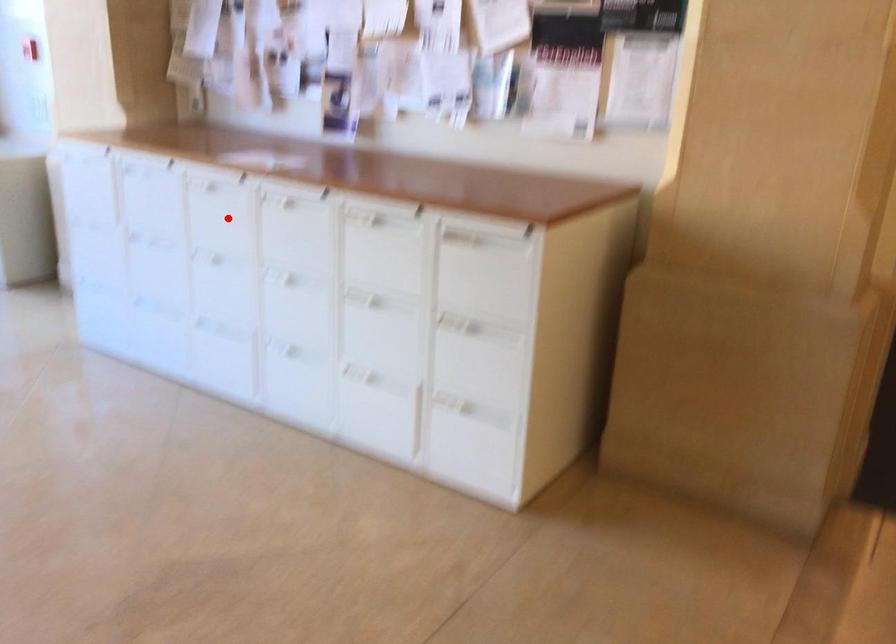
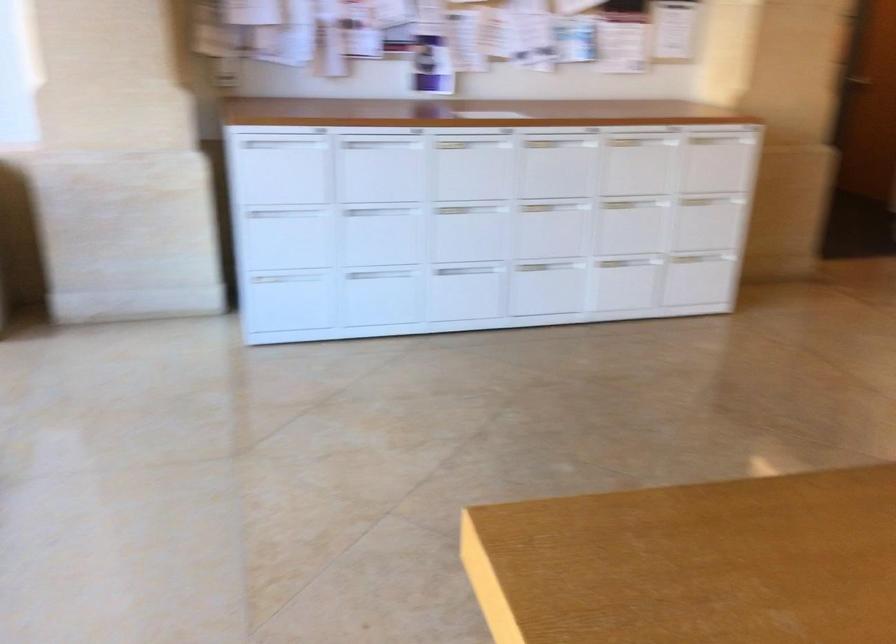
Question: I am providing you with two images of the same scene from different viewpoints. Given a red point in image1, look at the same physical point in image2. Is it:

Choices:
 (A) Closer to the viewpoint
 (B) Farther from the viewpoint

Answer: (B)